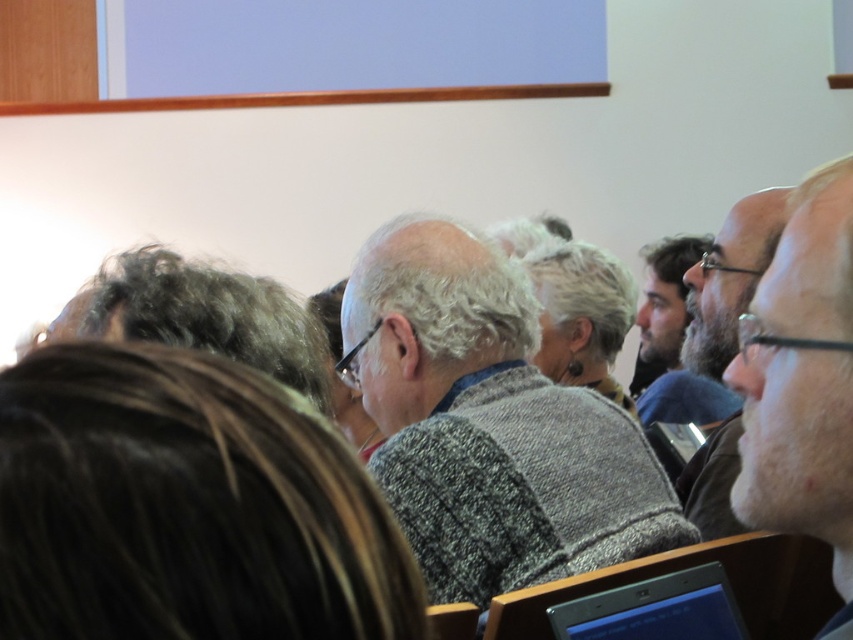
Is gray speckled sweater at center thinner than smooth skin face at right?

No, gray speckled sweater at center is not thinner than smooth skin face at right.

The width and height of the screenshot is (853, 640). Describe the element at coordinates (186, 506) in the screenshot. I see `gray speckled sweater at center` at that location.

Image resolution: width=853 pixels, height=640 pixels. I want to click on gray speckled sweater at center, so click(186, 506).

Measure the distance between gray speckled sweater at center and camera.

A distance of 12.62 inches exists between gray speckled sweater at center and camera.

Measure the distance between point (293, 436) and camera.

Point (293, 436) is 41.00 centimeters from camera.

Identify the location of gray speckled sweater at center. (186, 506).

Is smooth skin face at right to the right of gray wool sweater at center from the viewer's perspective?

No, smooth skin face at right is not to the right of gray wool sweater at center.

Which of these two, smooth skin face at right or gray wool sweater at center, stands taller?

gray wool sweater at center is taller.

Locate an element on the screen. The width and height of the screenshot is (853, 640). smooth skin face at right is located at coordinates [x=802, y=381].